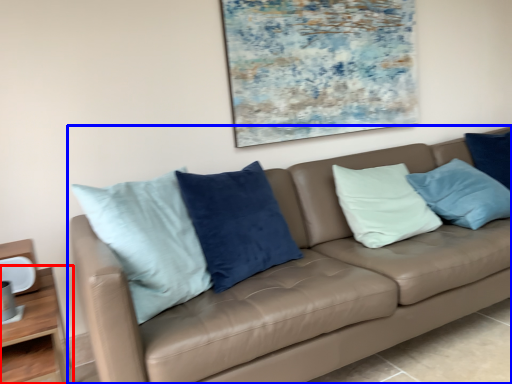
Question: Among these objects, which one is nearest to the camera, table (highlighted by a red box) or studio couch (highlighted by a blue box)?

Choices:
 (A) table
 (B) studio couch

Answer: (B)